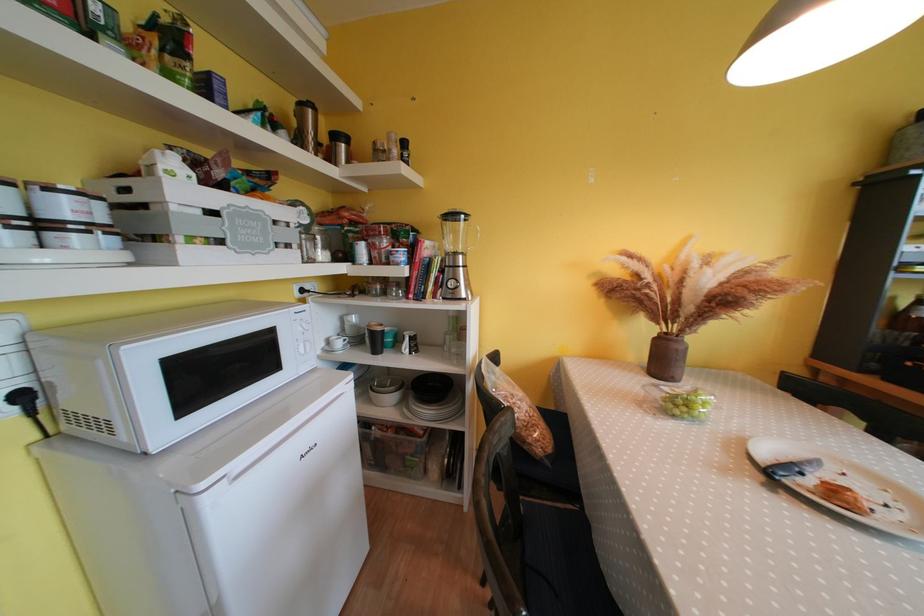
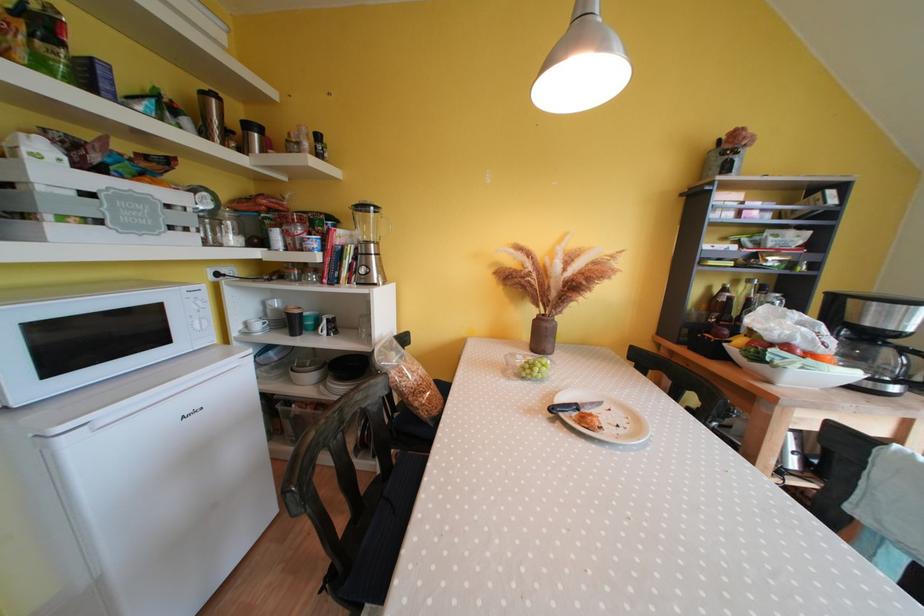
The point at (x=313, y=347) is marked in the first image. Where is the corresponding point in the second image?

(210, 325)